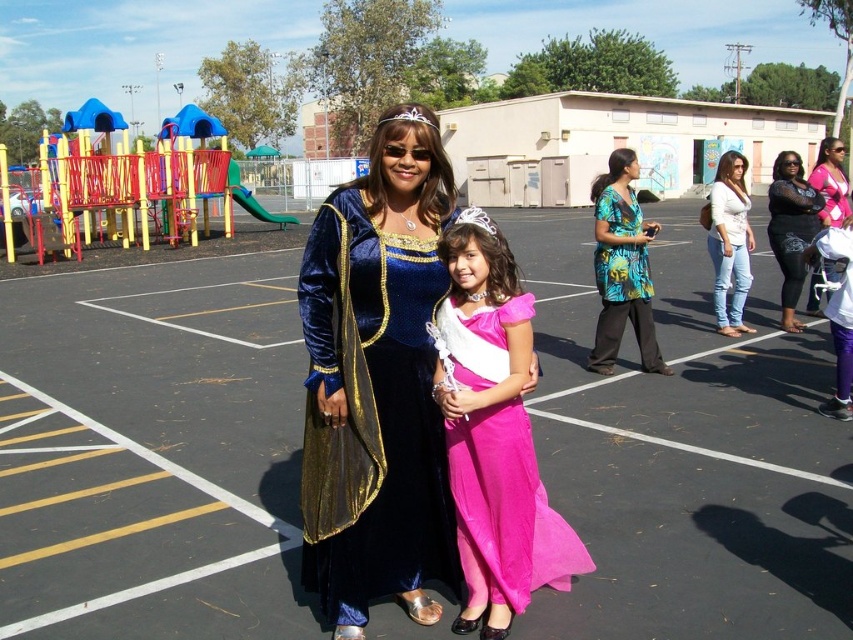
You are a photographer trying to capture a photo of both the white denim jeans at right and the pink satin dress at right. Since you want them to appear side by side in the frame, which one should you position closer to the left side of the camera?

The white denim jeans at right is positioned on the left side of pink satin dress at right, so you should place the white denim jeans at right closer to the left side of the camera to have them appear side by side.

You are a photographer trying to capture a clear shot of both the white denim jeans at right and the pink satin dress at right. Based on their positions, which one might be partially hidden in the photo?

The pink satin dress at right is partially hidden because the white denim jeans at right is positioned over it.